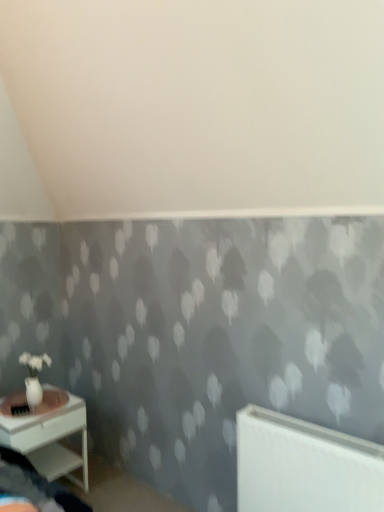
Question: Is white matte radiator at lower right spatially inside white glossy nightstand at lower left, or outside of it?

Choices:
 (A) outside
 (B) inside

Answer: (A)

Question: Looking at their shapes, would you say white matte radiator at lower right is wider or thinner than white glossy nightstand at lower left?

Choices:
 (A) wide
 (B) thin

Answer: (B)

Question: From a real-world perspective, relative to white glossy nightstand at lower left, is white matte radiator at lower right vertically above or below?

Choices:
 (A) below
 (B) above

Answer: (B)

Question: Considering the relative positions of white glossy nightstand at lower left and white matte radiator at lower right in the image provided, is white glossy nightstand at lower left to the left or to the right of white matte radiator at lower right?

Choices:
 (A) left
 (B) right

Answer: (A)

Question: Considering the positions of white glossy nightstand at lower left and white matte radiator at lower right in the image, is white glossy nightstand at lower left bigger or smaller than white matte radiator at lower right?

Choices:
 (A) small
 (B) big

Answer: (B)

Question: From the image's perspective, is white glossy nightstand at lower left above or below white matte radiator at lower right?

Choices:
 (A) below
 (B) above

Answer: (A)

Question: Considering the positions of white glossy nightstand at lower left and white matte radiator at lower right in the image, is white glossy nightstand at lower left wider or thinner than white matte radiator at lower right?

Choices:
 (A) wide
 (B) thin

Answer: (A)